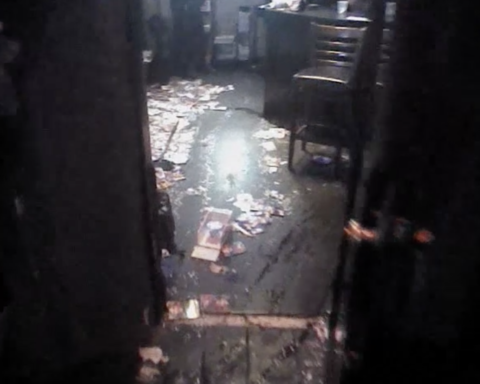
At what (x,y) coordinates should I click in order to perform the action: click on door handle. Please return your answer as a coordinate pair (x, y). This screenshot has height=384, width=480. Looking at the image, I should click on (375, 223).